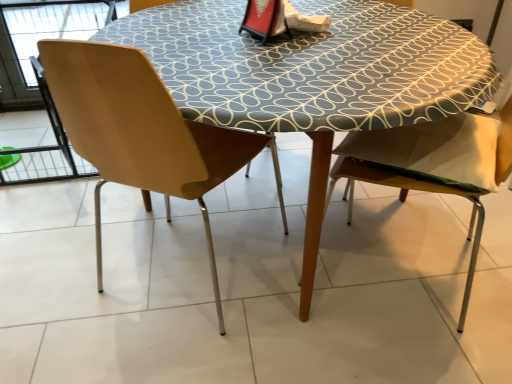
Question: Relative to wooden table at center, is wooden chair at right, which is the 1th chair from right to left, in front or behind?

Choices:
 (A) front
 (B) behind

Answer: (A)

Question: In the image, is wooden chair at right, the 2th chair when ordered from left to right, on the left side or the right side of wooden table at center?

Choices:
 (A) left
 (B) right

Answer: (B)

Question: Which is farther from the matte wood chair at left, arranged as the 1th chair when viewed from the left?

Choices:
 (A) wooden table at center
 (B) wooden chair at right, the 2th chair when ordered from left to right

Answer: (B)

Question: Estimate the real-world distances between objects in this image. Which object is farther from the wooden table at center?

Choices:
 (A) wooden chair at right, the 2th chair when ordered from left to right
 (B) matte wood chair at left, arranged as the 1th chair when viewed from the left

Answer: (A)